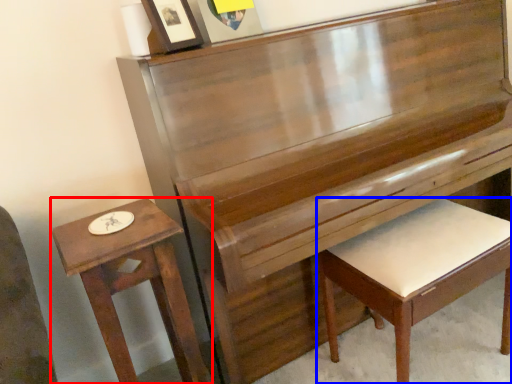
Question: Among these objects, which one is farthest to the camera, table (highlighted by a red box) or furniture (highlighted by a blue box)?

Choices:
 (A) table
 (B) furniture

Answer: (B)